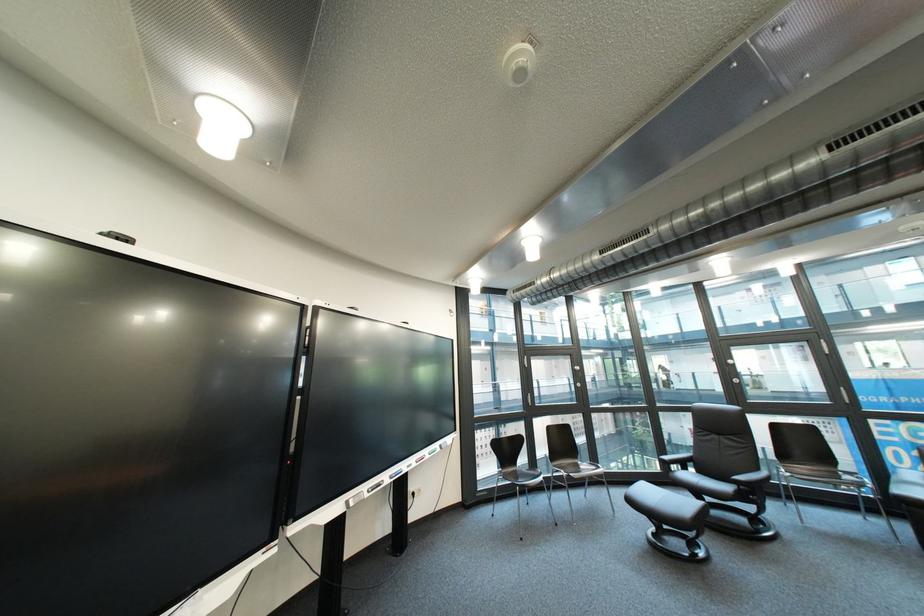
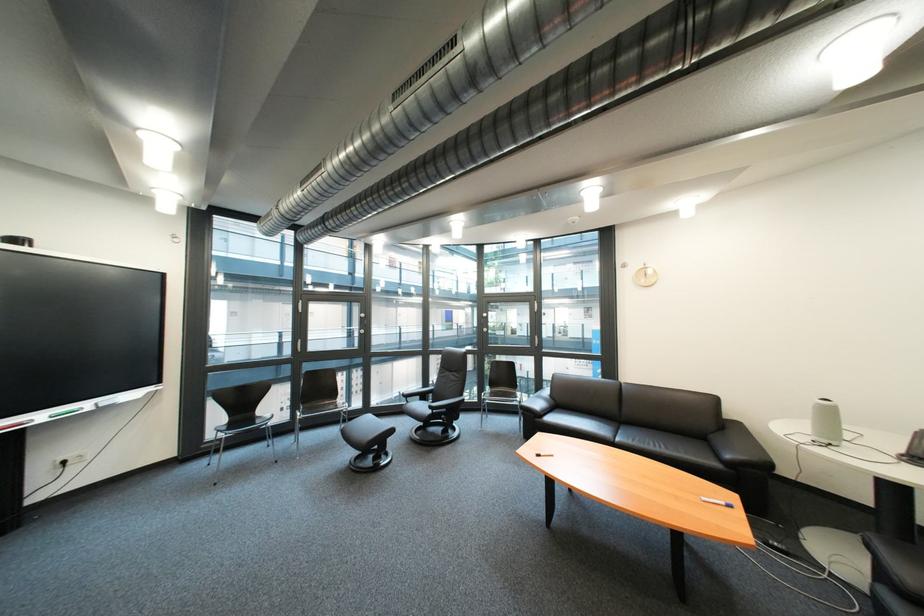
Where in the second image is the point corresponding to the point at 450,447 from the first image?

(101, 406)